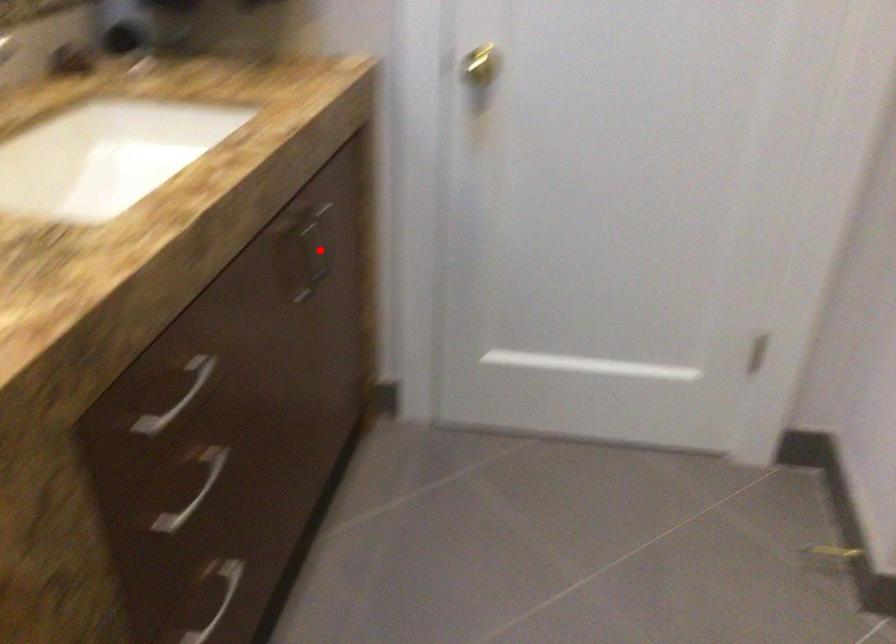
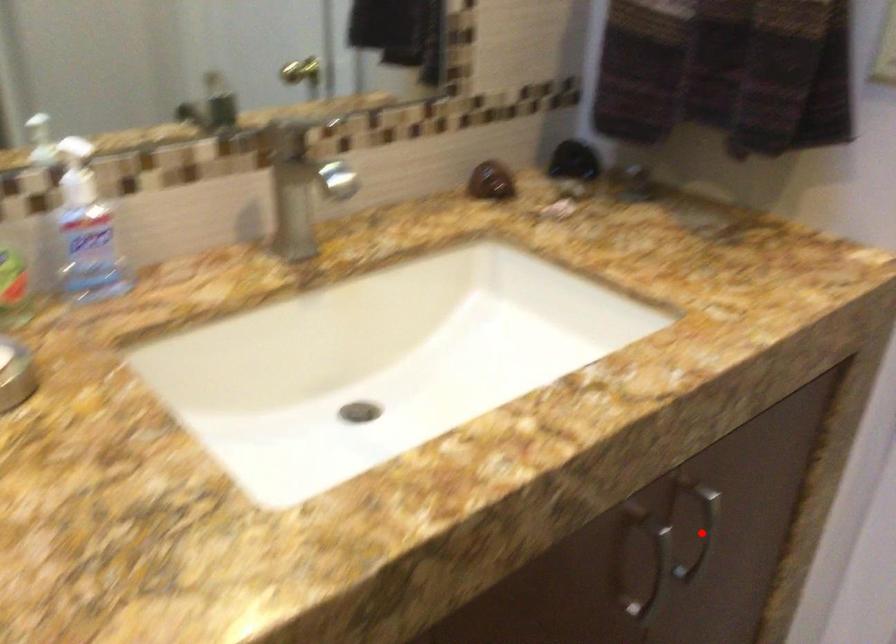
In the scene shown: I am providing you with two images of the same scene from different viewpoints. A red point is marked on the first image and another point is marked on the second image. Are the points marked in image1 and image2 representing the same 3D position?

Yes